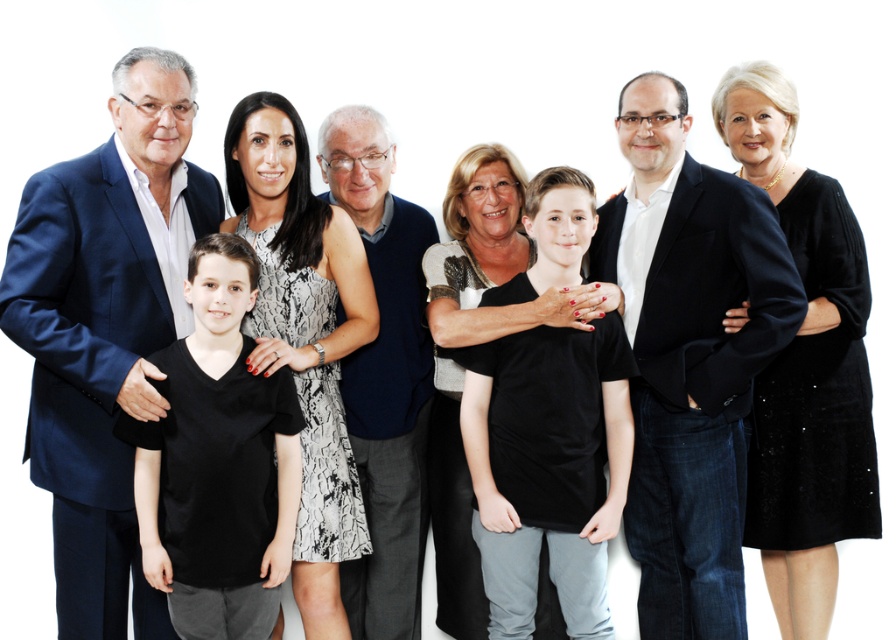
Question: Is black matte shirt at center closer to camera compared to dark blue sweater at center?

Choices:
 (A) yes
 (B) no

Answer: (A)

Question: Which of the following is the closest to the observer?

Choices:
 (A) (112, 163)
 (B) (498, 300)

Answer: (A)

Question: Is matte black suit at center to the left of black matte shirt at center from the viewer's perspective?

Choices:
 (A) yes
 (B) no

Answer: (B)

Question: Based on their relative distances, which object is farther from the matte black suit at center?

Choices:
 (A) black matte t-shirt at center
 (B) black matte shirt at center

Answer: (A)

Question: Which of the following is the closest to the observer?

Choices:
 (A) matte black suit at center
 (B) navy blue suit at left
 (C) dark blue sweater at center
 (D) black matte shirt at center

Answer: (B)

Question: Considering the relative positions of black matte t-shirt at center and dark blue sweater at center in the image provided, where is black matte t-shirt at center located with respect to dark blue sweater at center?

Choices:
 (A) right
 (B) left

Answer: (B)